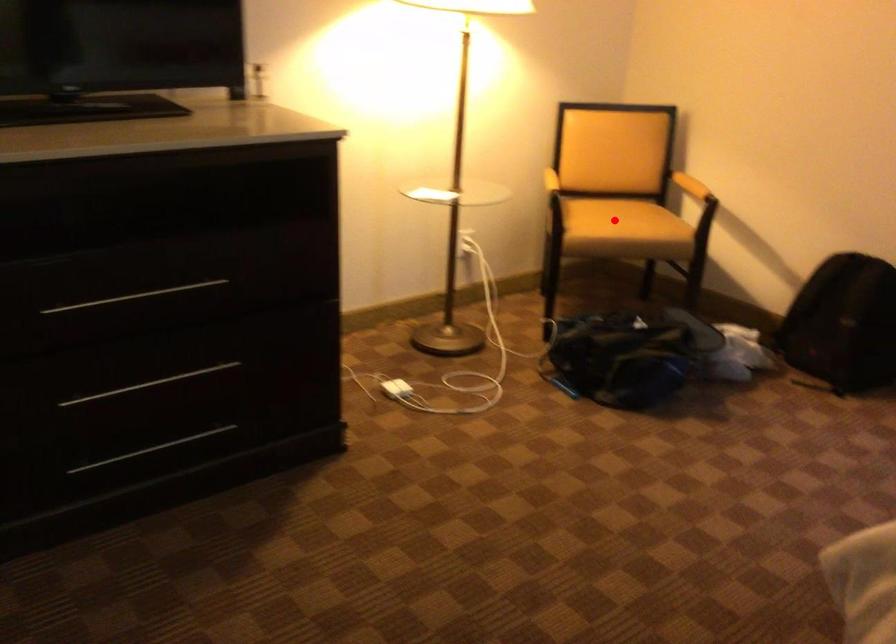
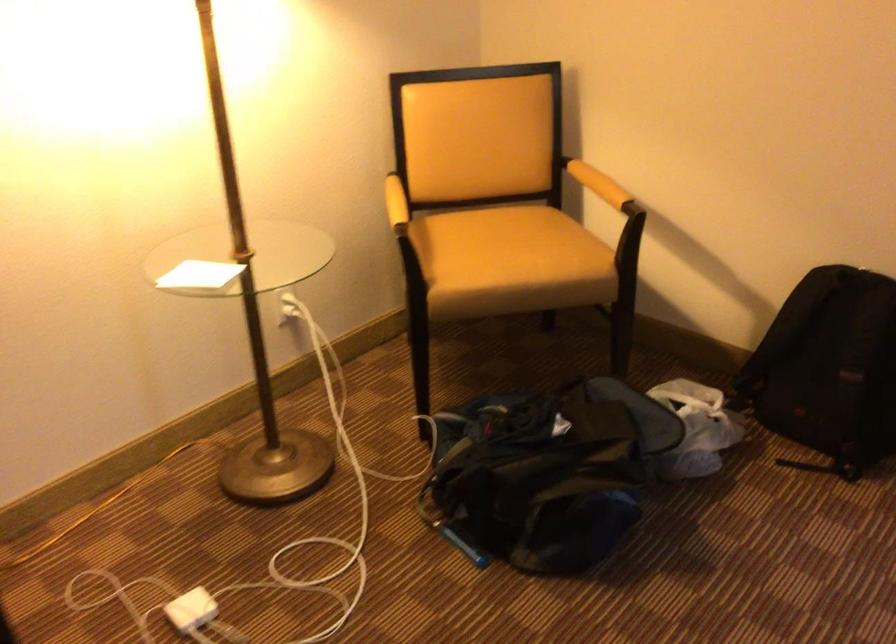
Question: A red point is marked in image1. In image2, is the corresponding 3D point closer to the camera or farther? Reply with the corresponding letter.

Choices:
 (A) The corresponding 3D point is closer.
 (B) The corresponding 3D point is farther.

Answer: (A)